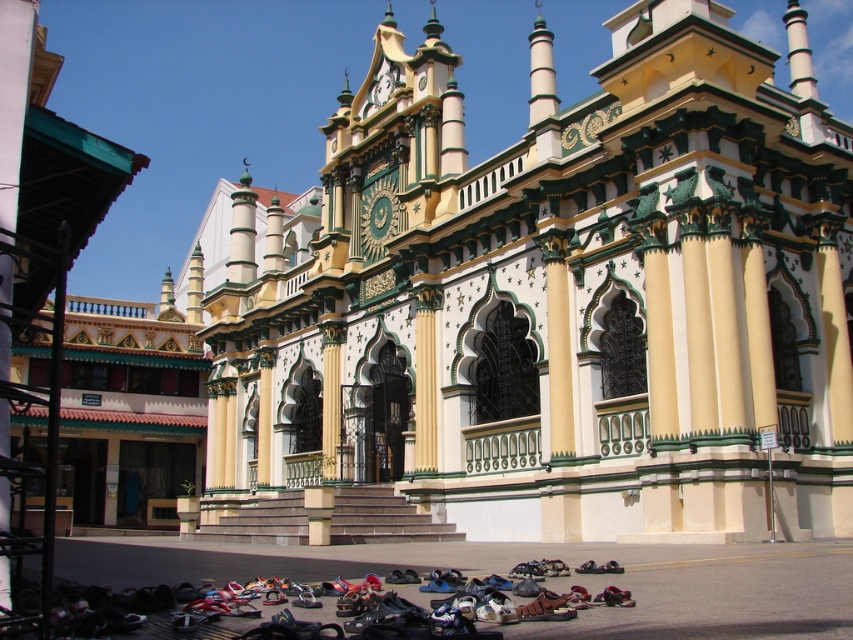
Question: Can you confirm if yellow painted stone palace at center is positioned to the right of leather sandals at lower center?

Choices:
 (A) no
 (B) yes

Answer: (A)

Question: Which of the following is the closest to the observer?

Choices:
 (A) leather sandals at lower center
 (B) yellow painted stone palace at center

Answer: (A)

Question: Which point is farther to the camera?

Choices:
 (A) (225, 609)
 (B) (349, 131)

Answer: (B)

Question: Considering the relative positions of yellow painted stone palace at center and leather sandals at lower center in the image provided, where is yellow painted stone palace at center located with respect to leather sandals at lower center?

Choices:
 (A) below
 (B) above

Answer: (B)

Question: Does yellow painted stone palace at center have a lesser width compared to leather sandals at lower center?

Choices:
 (A) no
 (B) yes

Answer: (A)

Question: Which point is farther to the camera?

Choices:
 (A) (491, 576)
 (B) (442, 152)

Answer: (B)